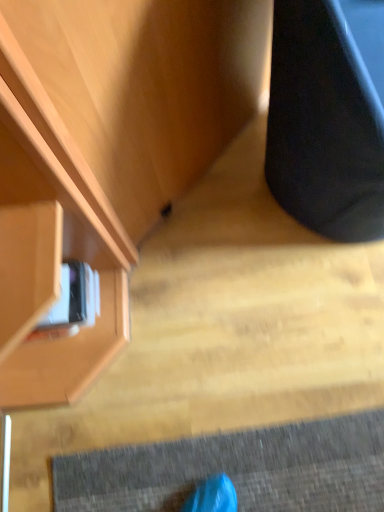
The height and width of the screenshot is (512, 384). Find the location of `matte wood cabinet at upper left`. matte wood cabinet at upper left is located at coordinates (106, 155).

This screenshot has height=512, width=384. Describe the element at coordinates (106, 155) in the screenshot. I see `matte wood cabinet at upper left` at that location.

Locate an element on the screen. The image size is (384, 512). black matte speaker at right is located at coordinates (324, 125).

Describe the element at coordinates (324, 125) in the screenshot. Image resolution: width=384 pixels, height=512 pixels. I see `black matte speaker at right` at that location.

Locate an element on the screen. This screenshot has width=384, height=512. matte wood cabinet at upper left is located at coordinates (106, 155).

Is black matte speaker at right to the right of matte wood cabinet at upper left from the viewer's perspective?

Yes.

Between black matte speaker at right and matte wood cabinet at upper left, which one is positioned behind?

matte wood cabinet at upper left is more distant.

Is point (380, 198) less distant than point (107, 278)?

Yes, point (380, 198) is closer to viewer.

From the image's perspective, does black matte speaker at right appear lower than matte wood cabinet at upper left?

No.

From a real-world perspective, which object rests below the other?

In real-world perspective, matte wood cabinet at upper left is lower.

Which of these two, black matte speaker at right or matte wood cabinet at upper left, is thinner?

black matte speaker at right is thinner.

In the scene shown: Who is shorter, black matte speaker at right or matte wood cabinet at upper left?

Standing shorter between the two is matte wood cabinet at upper left.

Is black matte speaker at right bigger than matte wood cabinet at upper left?

Yes.

Is black matte speaker at right surrounding matte wood cabinet at upper left?

No, matte wood cabinet at upper left is not surrounded by black matte speaker at right.

Are black matte speaker at right and matte wood cabinet at upper left beside each other?

No, black matte speaker at right is not in contact with matte wood cabinet at upper left.

Could you tell me if black matte speaker at right is facing matte wood cabinet at upper left?

No, black matte speaker at right is not turned towards matte wood cabinet at upper left.

How many degrees apart are the facing directions of black matte speaker at right and matte wood cabinet at upper left?

The angle between the facing direction of black matte speaker at right and the facing direction of matte wood cabinet at upper left is 143 degrees.

How distant is black matte speaker at right from matte wood cabinet at upper left?

They are 12.32 inches apart.

You are a GUI agent. You are given a task and a screenshot of the screen. Output one action in this format:
    pyautogui.click(x=<x>, y=<y>)
    Task: Click on the furniture above the matte wood cabinet at upper left (from the image's perspective)
    The image size is (384, 512).
    Given the screenshot: What is the action you would take?
    pyautogui.click(x=324, y=125)

Considering the relative positions of matte wood cabinet at upper left and black matte speaker at right in the image provided, is matte wood cabinet at upper left to the left or to the right of black matte speaker at right?

matte wood cabinet at upper left is to the left of black matte speaker at right.

In the scene shown: Which is in front, matte wood cabinet at upper left or black matte speaker at right?

black matte speaker at right is more forward.

Which point is more distant from viewer, (50, 58) or (333, 159)?

Positioned behind is point (333, 159).

From the image's perspective, is matte wood cabinet at upper left located above black matte speaker at right?

No, from the image's perspective, matte wood cabinet at upper left is not above black matte speaker at right.

From a real-world perspective, is matte wood cabinet at upper left physically located above or below black matte speaker at right?

matte wood cabinet at upper left is below black matte speaker at right.

Which object is thinner, matte wood cabinet at upper left or black matte speaker at right?

black matte speaker at right.

Is matte wood cabinet at upper left taller or shorter than black matte speaker at right?

Considering their sizes, matte wood cabinet at upper left has less height than black matte speaker at right.

Considering the sizes of matte wood cabinet at upper left and black matte speaker at right in the image, is matte wood cabinet at upper left bigger or smaller than black matte speaker at right?

Considering their sizes, matte wood cabinet at upper left takes up less space than black matte speaker at right.

Can we say matte wood cabinet at upper left lies outside black matte speaker at right?

Indeed, matte wood cabinet at upper left is completely outside black matte speaker at right.

Would you consider matte wood cabinet at upper left to be distant from black matte speaker at right?

matte wood cabinet at upper left is actually quite close to black matte speaker at right.

Looking at this image, is black matte speaker at right at the back of matte wood cabinet at upper left?

No.

Locate an element on the screen. The width and height of the screenshot is (384, 512). furniture above the matte wood cabinet at upper left (from a real-world perspective) is located at coordinates 324,125.

Image resolution: width=384 pixels, height=512 pixels. I want to click on furniture that is above the matte wood cabinet at upper left (from a real-world perspective), so click(324, 125).

In order to click on furniture above the matte wood cabinet at upper left (from the image's perspective) in this screenshot , I will do `click(324, 125)`.